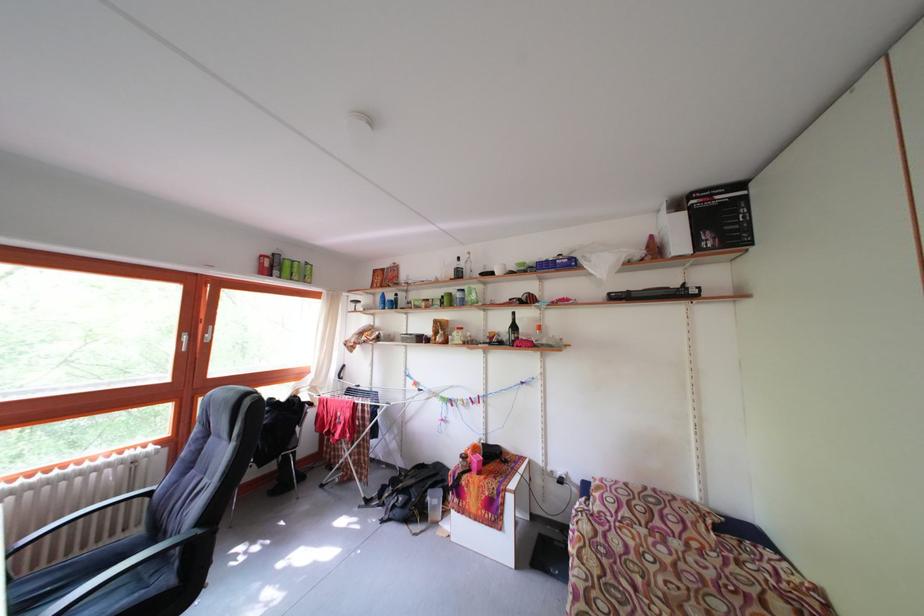
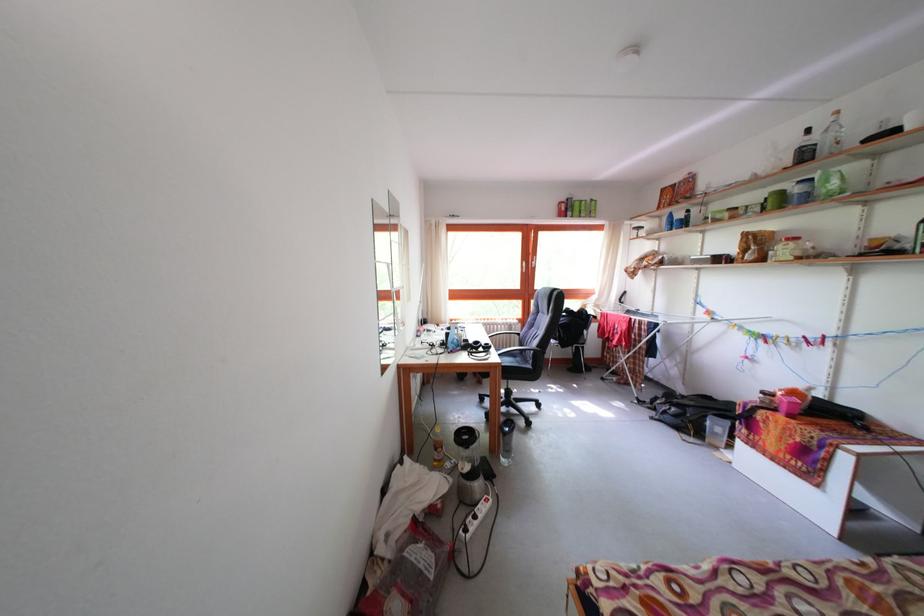
The point at (476, 262) is marked in the first image. Where is the corresponding point in the second image?

(843, 124)